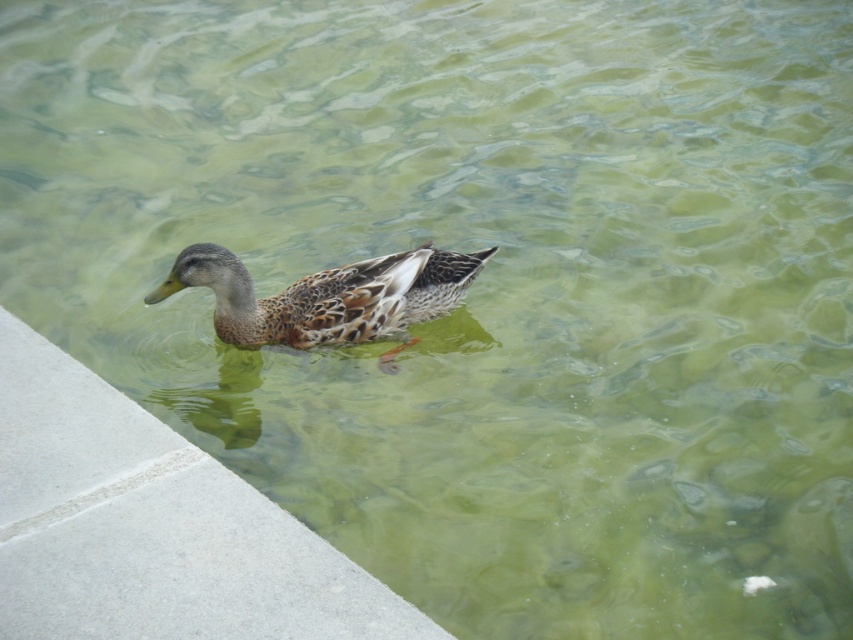
Question: Does gray concrete ledge at lower left appear under brown speckled duck at center?

Choices:
 (A) no
 (B) yes

Answer: (B)

Question: Does gray concrete ledge at lower left have a smaller size compared to brown speckled duck at center?

Choices:
 (A) no
 (B) yes

Answer: (A)

Question: Among these objects, which one is nearest to the camera?

Choices:
 (A) gray concrete ledge at lower left
 (B) brown speckled duck at center

Answer: (A)

Question: Is gray concrete ledge at lower left above brown speckled duck at center?

Choices:
 (A) yes
 (B) no

Answer: (B)